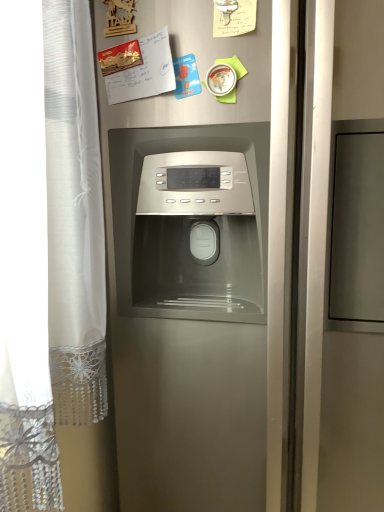
Describe the element at coordinates (202, 267) in the screenshot. I see `satin silver water dispenser at center` at that location.

At what (x,y) coordinates should I click in order to perform the action: click on satin silver water dispenser at center. Please return your answer as a coordinate pair (x, y). The width and height of the screenshot is (384, 512). Looking at the image, I should click on (202, 267).

Locate an element on the screen. This screenshot has height=512, width=384. satin silver water dispenser at center is located at coordinates (x=202, y=267).